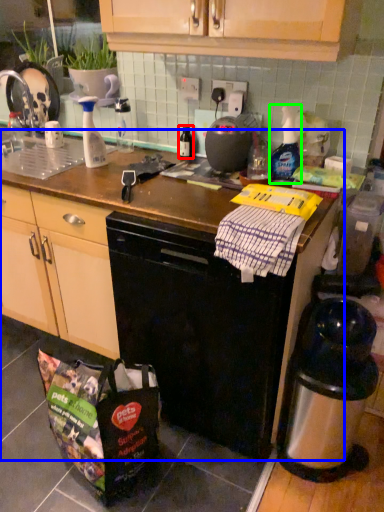
Question: Which object is positioned farthest from bottle (highlighted by a red box)? Select from counter top (highlighted by a blue box) and bottle (highlighted by a green box).

Choices:
 (A) counter top
 (B) bottle

Answer: (A)